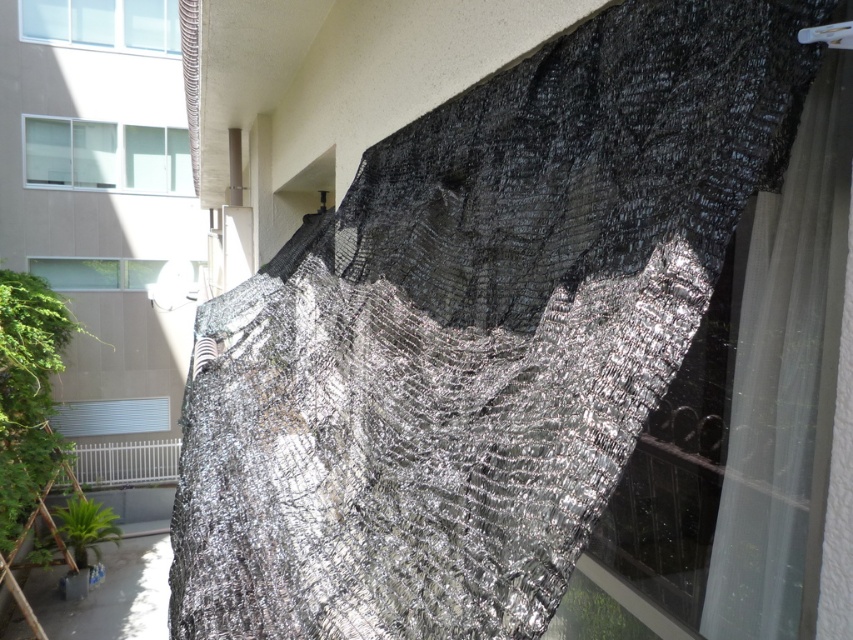
Which of these two, clear glass window at upper left or metallic mesh at upper right, stands shorter?

metallic mesh at upper right is shorter.

Looking at this image, does clear glass window at upper left have a lesser width compared to metallic mesh at upper right?

In fact, clear glass window at upper left might be wider than metallic mesh at upper right.

Image resolution: width=853 pixels, height=640 pixels. What are the coordinates of `clear glass window at upper left` in the screenshot? It's located at (106, 156).

Locate an element on the screen. The height and width of the screenshot is (640, 853). clear glass window at upper left is located at coordinates (106, 156).

The width and height of the screenshot is (853, 640). Find the location of `white sheer curtain at upper right`. white sheer curtain at upper right is located at coordinates (785, 381).

Which of these two, white sheer curtain at upper right or metallic mesh at upper right, stands shorter?

metallic mesh at upper right is shorter.

Image resolution: width=853 pixels, height=640 pixels. In order to click on white sheer curtain at upper right in this screenshot , I will do `click(785, 381)`.

Who is taller, clear glass window at upper left or transparent glass window at upper left?

Standing taller between the two is clear glass window at upper left.

Does clear glass window at upper left appear over transparent glass window at upper left?

Actually, clear glass window at upper left is below transparent glass window at upper left.

Which is behind, point (169, 138) or point (80, 4)?

Positioned behind is point (169, 138).

Identify the location of clear glass window at upper left. (106, 156).